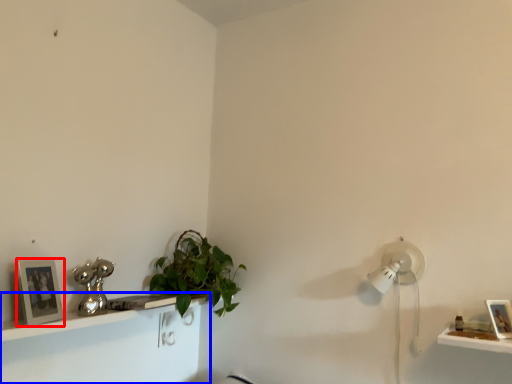
Question: Which object is closer to the camera taking this photo, picture frame (highlighted by a red box) or shelf (highlighted by a blue box)?

Choices:
 (A) picture frame
 (B) shelf

Answer: (B)